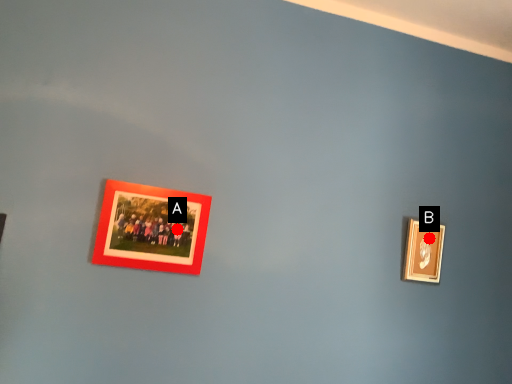
Question: Two points are circled on the image, labeled by A and B beside each circle. Which of the following is the closest to the observer?

Choices:
 (A) A is closer
 (B) B is closer

Answer: (A)